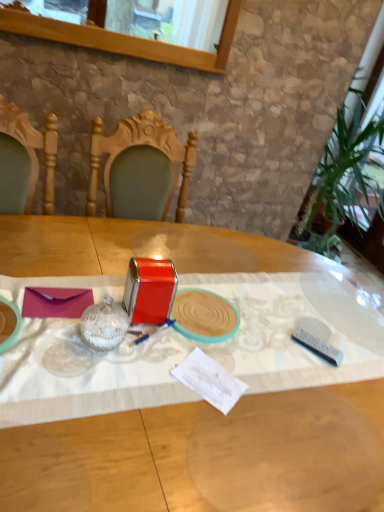
At what (x,y) coordinates should I click in order to perform the action: click on free space between white plastic remote at lower right, acting as the 4th tableware starting from the left, and metallic red tin at center, marked as the third tableware in a left-to-right arrangement. Please return your answer as a coordinate pair (x, y). Image resolution: width=384 pixels, height=512 pixels. Looking at the image, I should click on tap(261, 341).